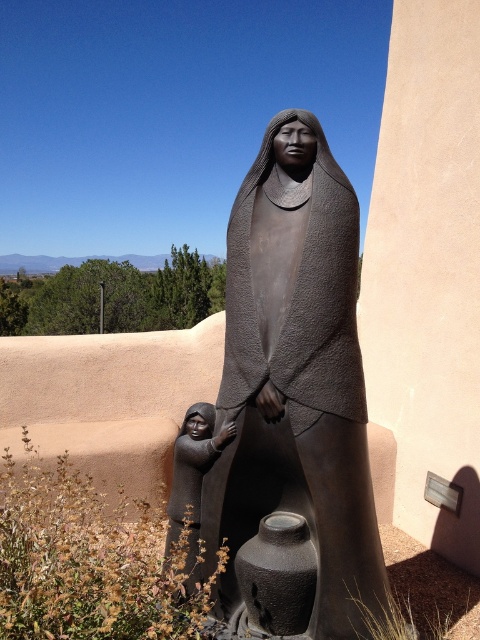
Between matte bronze statue at center and matte black figure at lower left, which one is positioned lower?

matte black figure at lower left is below.

Is matte bronze statue at center to the right of matte black figure at lower left from the viewer's perspective?

Yes, matte bronze statue at center is to the right of matte black figure at lower left.

The width and height of the screenshot is (480, 640). Describe the element at coordinates (292, 406) in the screenshot. I see `matte bronze statue at center` at that location.

The width and height of the screenshot is (480, 640). In order to click on matte bronze statue at center in this screenshot , I will do `click(292, 406)`.